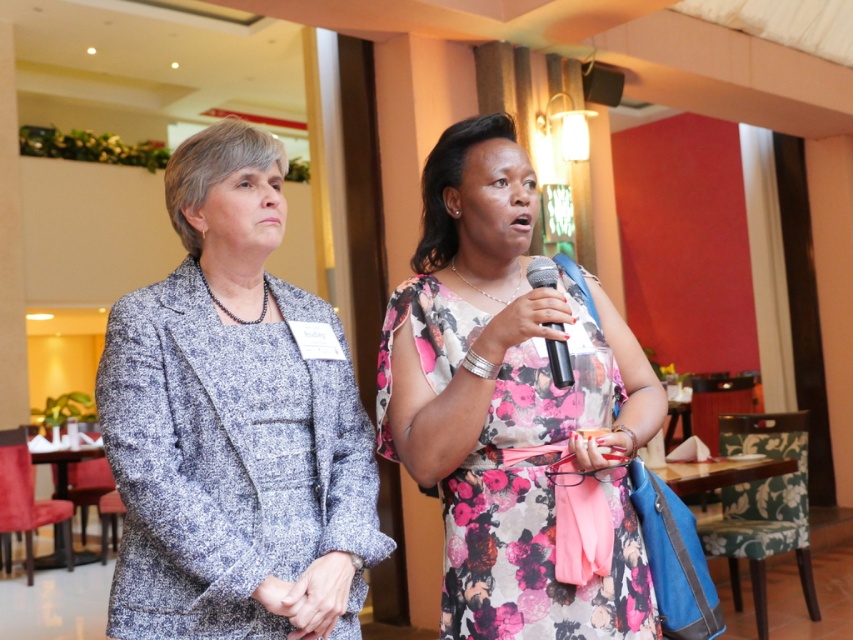
You are standing in the conference room and want to determine which of the two points, point (468, 268) or point (555, 348), is closer to you. Based on the image, which one is nearer?

Point (468, 268) is further to the camera than point (555, 348), so the point closer to you is point (555, 348).

You are organizing a photo shoot and need to ensure proper focus on both the speckled wool blazer at left and the floral dress at center. Based on their positions, which clothing item should be prioritized for focus to ensure the foreground is sharp?

The speckled wool blazer at left should be prioritized for focus since it is in front of the floral dress at center, making it the foreground element.

Based on the coordinates provided in the scene, where is the speckled wool blazer at left located?

The speckled wool blazer at left is located at the coordinates point (234, 422).